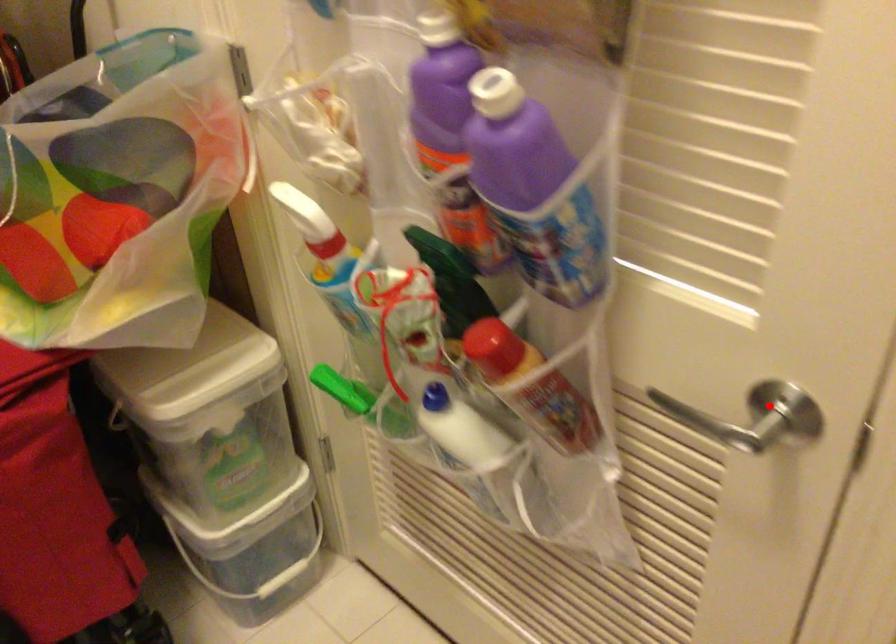
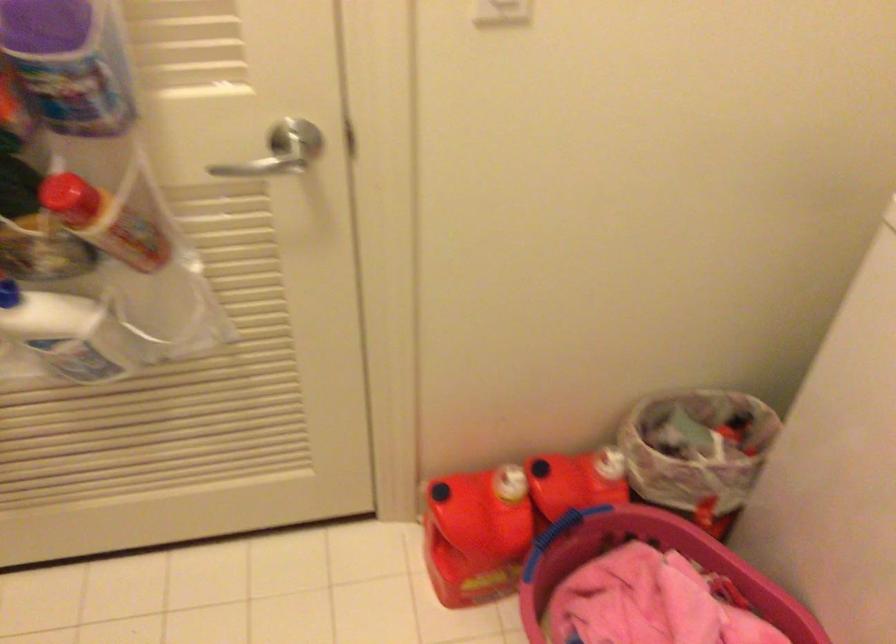
Question: I am providing you with two images of the same scene from different viewpoints. Given a red point in image1, look at the same physical point in image2. Is it:

Choices:
 (A) Closer to the viewpoint
 (B) Farther from the viewpoint

Answer: (B)